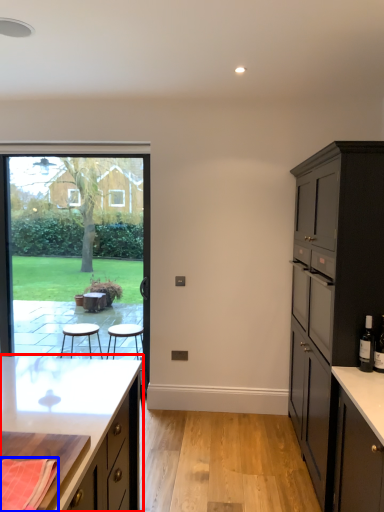
Question: Which of the following is the closest to the observer, cabinetry (highlighted by a red box) or material (highlighted by a blue box)?

Choices:
 (A) cabinetry
 (B) material

Answer: (B)